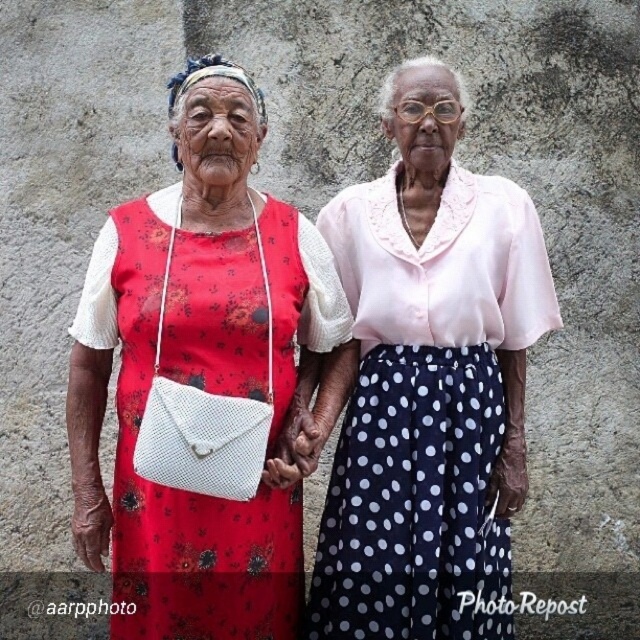
You are standing at the origin point in the image. Which direction should you move to reach the matte floral dress at center?

The matte floral dress at center is located at coordinates 0.577 on the x axis and 0.481 on the y axis. Since you are at the origin point, you should move towards the right and slightly upwards to reach it.

You are a photographer trying to capture a closeup of the dark blue polka dot skirt at center. Given that the camera can only focus on objects within a 0.1 unit radius around the point specified, will the skirt be in focus at point (426, 410)?

The dark blue polka dot skirt at center is represented by point (426, 410), so yes, the skirt will be in focus at that point since the camera focuses within a 0.1 unit radius around the specified point.

You are a photographer setting up a shoot for two models wearing the matte floral dress at center and the red floral fabric dress at left. You want to ensure that the smaller dress is clearly visible in the composition. Which dress should you place closer to the camera to maintain its visibility?

The matte floral dress at center is smaller in size compared to the red floral fabric dress at left. To ensure visibility, place the matte floral dress at center closer to the camera.